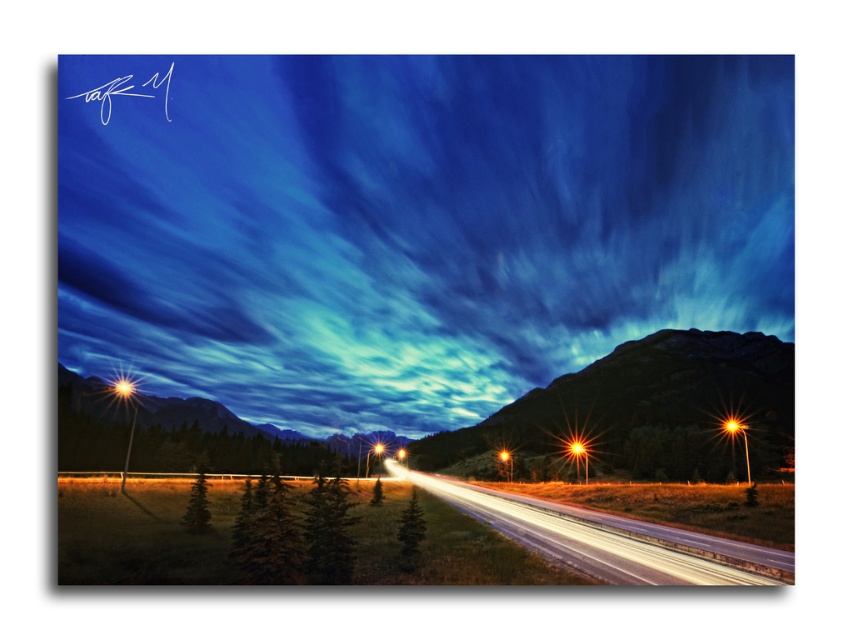
Question: Which point is farther to the camera?

Choices:
 (A) bright orange starburst at center
 (B) smooth asphalt road at center
 (C) white asphalt highway at center

Answer: (A)

Question: Does rocky brown mountain at center-right have a greater width compared to bright orange light at right?

Choices:
 (A) yes
 (B) no

Answer: (A)

Question: Which object appears farthest from the camera in this image?

Choices:
 (A) orange glossy traffic light at center
 (B) orange glass traffic light at center

Answer: (B)

Question: Does smooth asphalt road at center appear on the right side of orange glass traffic light at center?

Choices:
 (A) no
 (B) yes

Answer: (B)

Question: Among these objects, which one is farthest from the camera?

Choices:
 (A) rocky brown mountain at center-right
 (B) orange glossy streetlight at center

Answer: (B)

Question: Does smooth asphalt road at center have a smaller size compared to bright orange starburst at center?

Choices:
 (A) yes
 (B) no

Answer: (B)